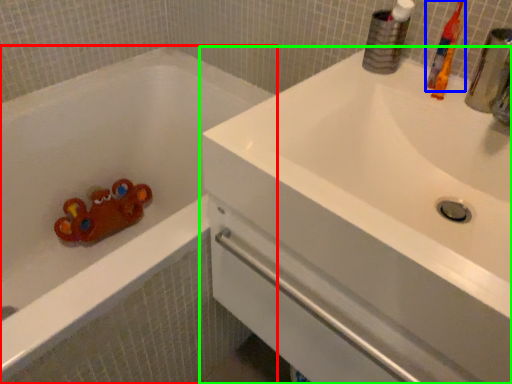
Question: Based on their relative distances, which object is nearer to bathtub (highlighted by a red box)? Choose from toothbrush (highlighted by a blue box) and sink (highlighted by a green box).

Choices:
 (A) toothbrush
 (B) sink

Answer: (B)